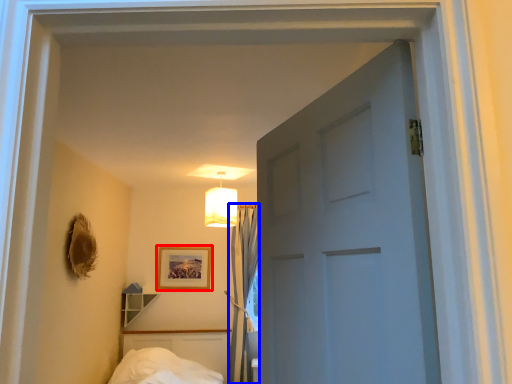
Question: Which object appears farthest to the camera in this image, picture frame (highlighted by a red box) or curtain (highlighted by a blue box)?

Choices:
 (A) picture frame
 (B) curtain

Answer: (A)